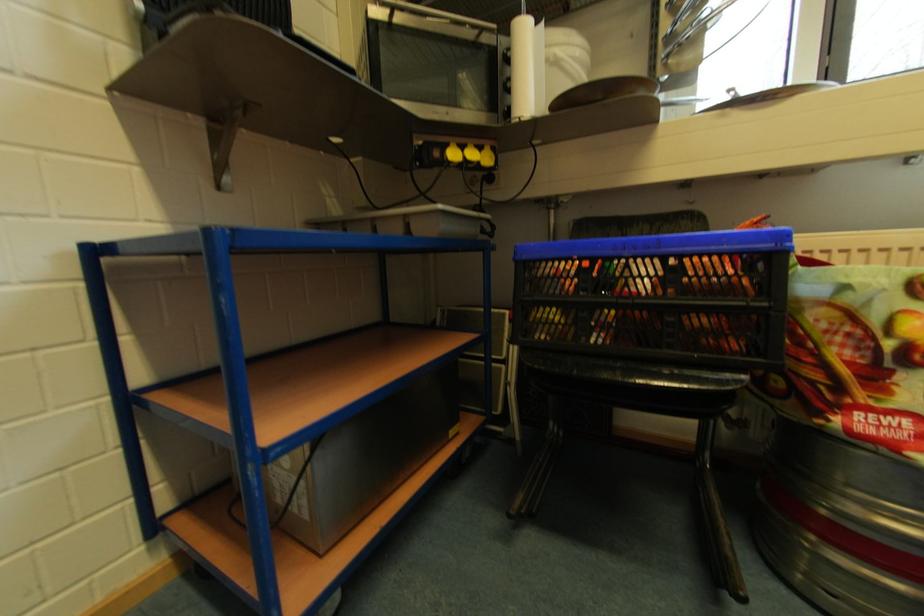
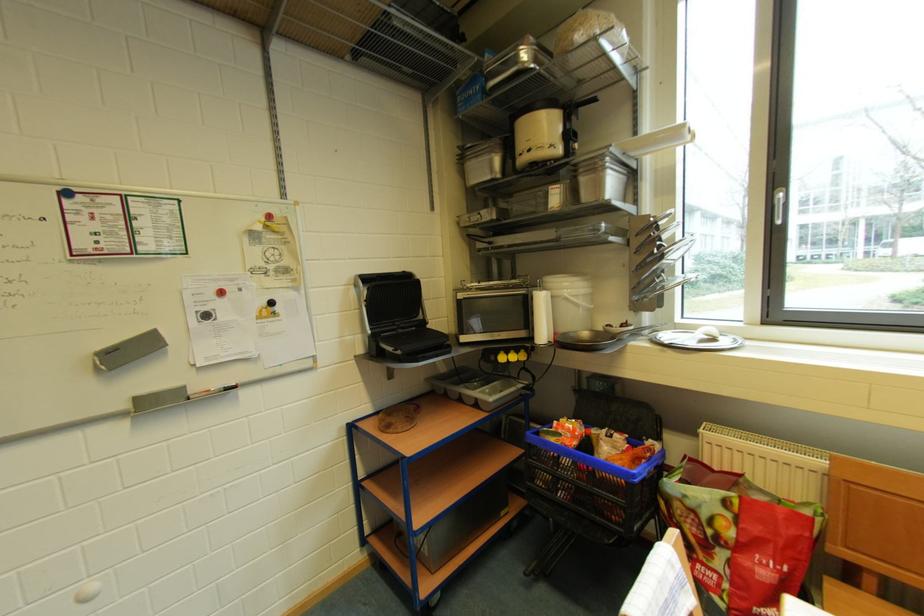
Find the pixel in the second image that matches the point at 444,156 in the first image.

(500, 361)